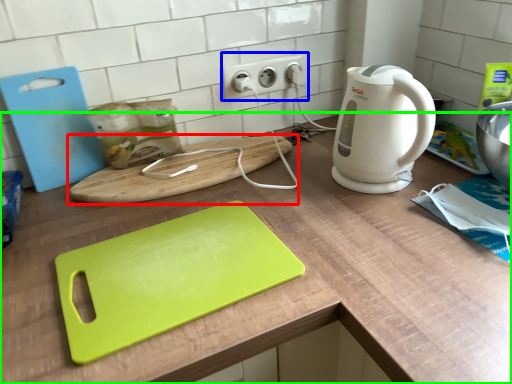
Question: Estimate the real-world distances between objects in this image. Which object is farther from cutting board (highlighted by a red box), electric outlet (highlighted by a blue box) or counter (highlighted by a green box)?

Choices:
 (A) electric outlet
 (B) counter

Answer: (A)